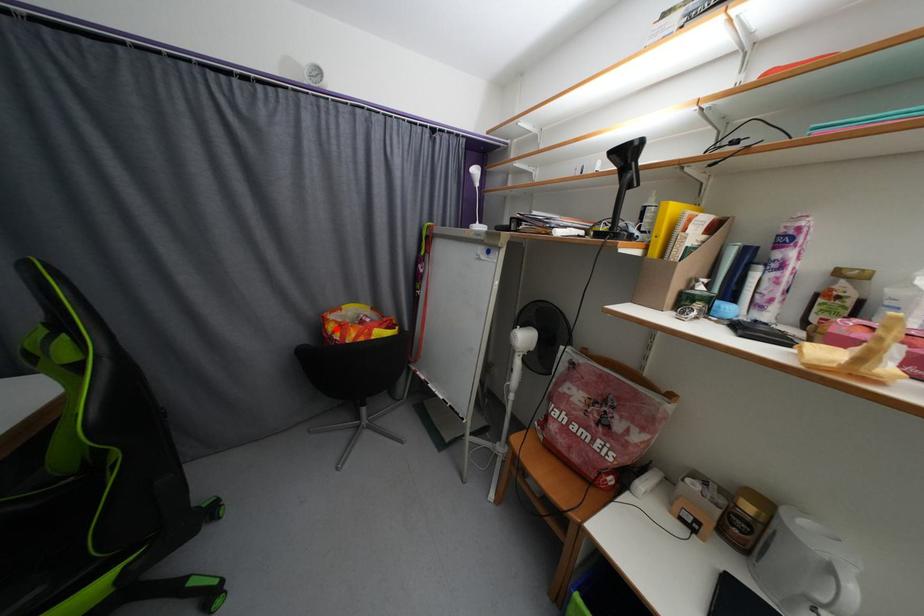
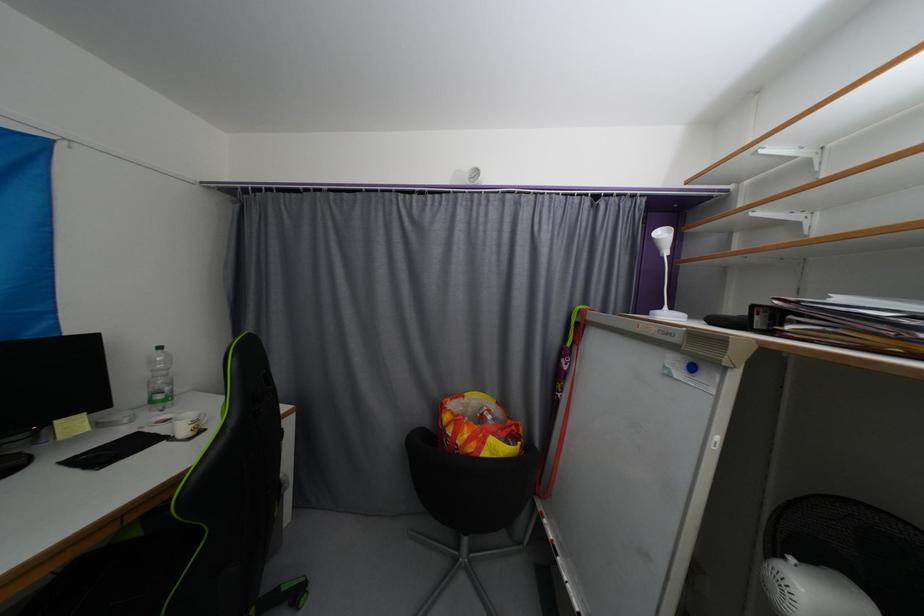
Find the pixel in the second image that matches the highlighted location in the first image.

(452, 419)